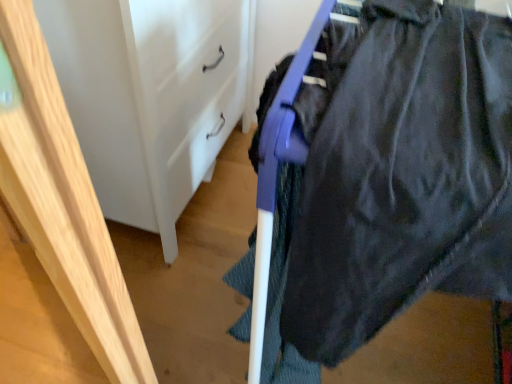
Question: From a real-world perspective, is light wood frame at left positioned above or below white matte/file cabinet at center?

Choices:
 (A) below
 (B) above

Answer: (B)

Question: In terms of height, does light wood frame at left look taller or shorter compared to white matte/file cabinet at center?

Choices:
 (A) short
 (B) tall

Answer: (B)

Question: Considering the real-world distances, which object is closest to the white matte/file cabinet at center?

Choices:
 (A) dark matte fabric at upper right
 (B) light wood frame at left

Answer: (B)

Question: Estimate the real-world distances between objects in this image. Which object is closer to the dark matte fabric at upper right?

Choices:
 (A) white matte/file cabinet at center
 (B) light wood frame at left

Answer: (B)